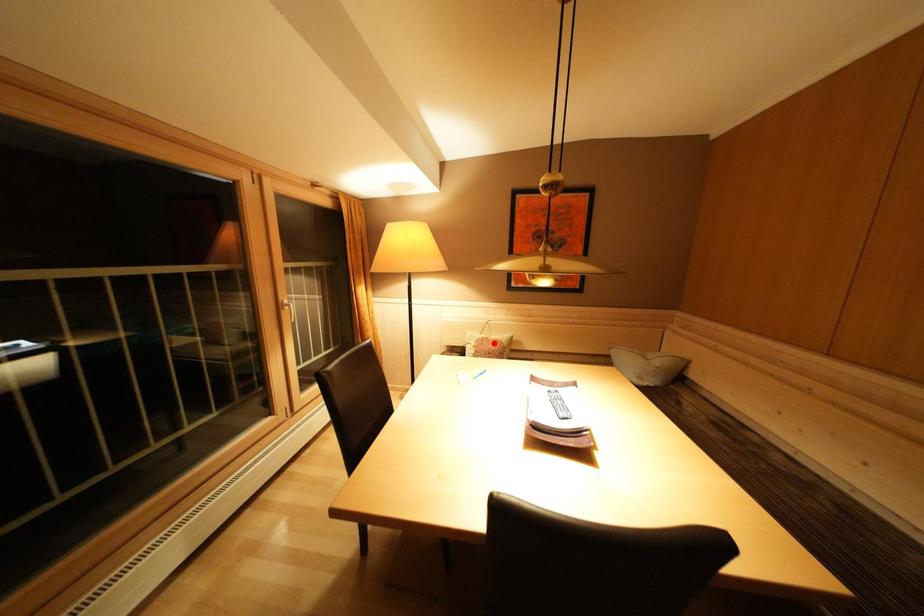
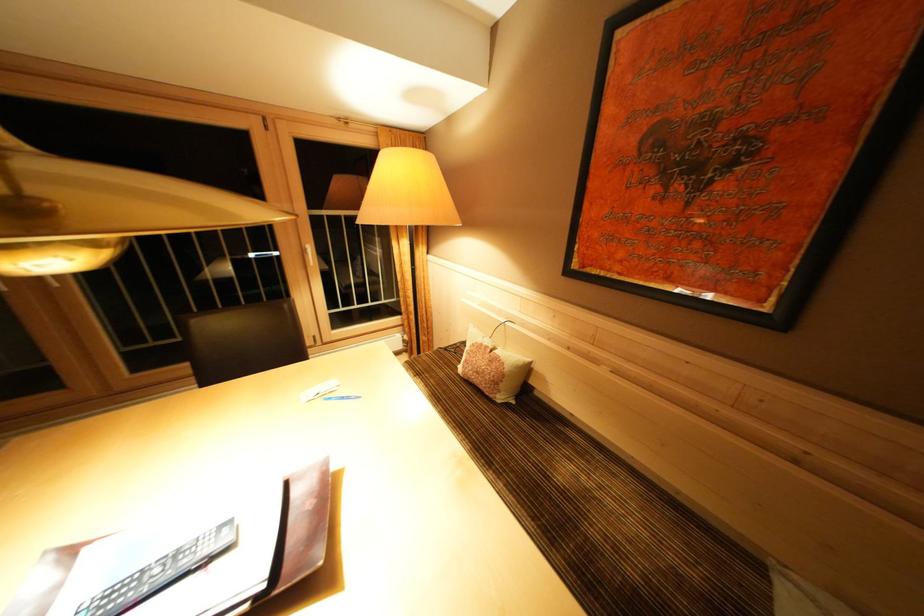
Question: I am providing you with two images of the same scene from different viewpoints. A red point is marked on the first image. Is the red point's position out of view in image 2?

Choices:
 (A) Yes
 (B) No

Answer: (B)